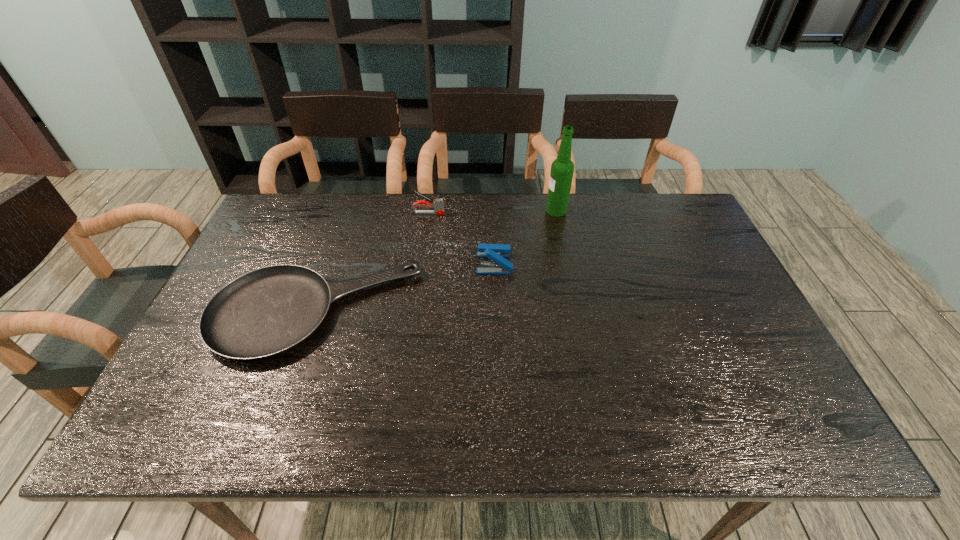
Find the location of a particular element. Image resolution: width=960 pixels, height=540 pixels. free space between the nearer stapler and the farther stapler is located at coordinates (461, 238).

Find the location of a particular element. the closest object to the beer bottle is located at coordinates (496, 252).

Identify which object is the second nearest to the tallest object. Please provide its 2D coordinates. Your answer should be formatted as a tuple, i.e. [(x, y)], where the tuple contains the x and y coordinates of a point satisfying the conditions above.

[(438, 205)]

I want to click on free space that satisfies the following two spatial constraints: 1. on the handle side of the farther stapler; 2. on the back side of the right stapler, so click(x=420, y=263).

I want to click on vacant area in the image that satisfies the following two spatial constraints: 1. on the handle side of the farther stapler; 2. on the right side of the right stapler, so click(x=420, y=263).

I want to click on free space that satisfies the following two spatial constraints: 1. on the label of the rightmost object; 2. on the front side of the nearer stapler, so click(567, 263).

The width and height of the screenshot is (960, 540). Find the location of `vacant space that satisfies the following two spatial constraints: 1. on the label of the beer bottle; 2. on the front side of the shortest object`. vacant space that satisfies the following two spatial constraints: 1. on the label of the beer bottle; 2. on the front side of the shortest object is located at coordinates (577, 313).